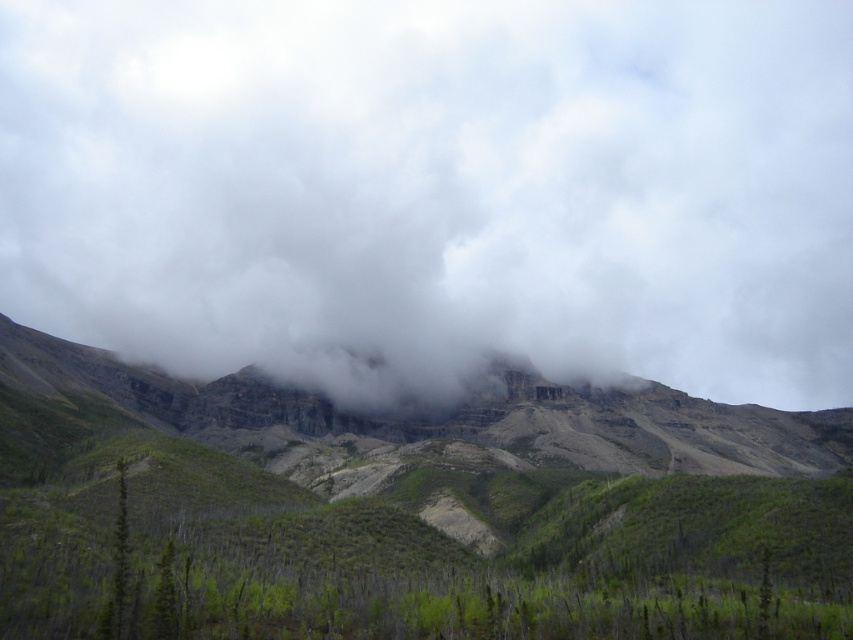
Question: Which point is farther to the camera?

Choices:
 (A) rocky cliff at center
 (B) gray/cloudy mountain at upper center

Answer: (B)

Question: Among these points, which one is farthest from the camera?

Choices:
 (A) (113, 589)
 (B) (804, 330)

Answer: (B)

Question: Can you confirm if rocky cliff at center is smaller than green matte tree at left?

Choices:
 (A) no
 (B) yes

Answer: (A)

Question: Observing the image, what is the correct spatial positioning of rocky cliff at center in reference to green matte tree at left?

Choices:
 (A) left
 (B) right

Answer: (B)

Question: Does rocky cliff at center appear on the right side of green matte tree at left?

Choices:
 (A) no
 (B) yes

Answer: (B)

Question: Based on their relative distances, which object is nearer to the gray/cloudy mountain at upper center?

Choices:
 (A) green matte tree at left
 (B) rocky cliff at center

Answer: (B)